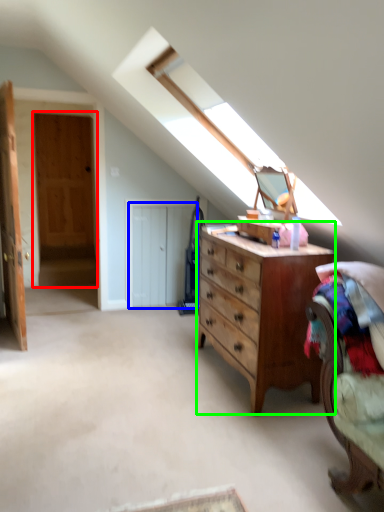
Question: Which object is positioned farthest from door (highlighted by a red box)? Select from door (highlighted by a blue box) and chest of drawers (highlighted by a green box).

Choices:
 (A) door
 (B) chest of drawers

Answer: (B)